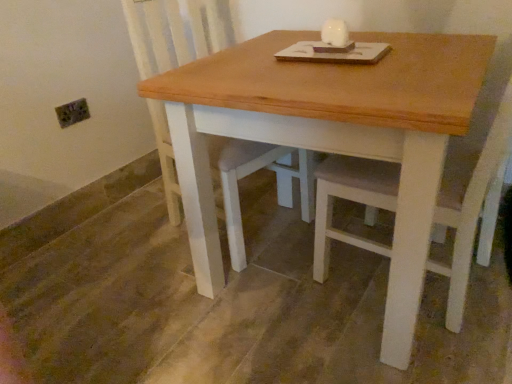
Question: From a real-world perspective, is wooden swivel chair at center located higher than wooden table at center?

Choices:
 (A) yes
 (B) no

Answer: (A)

Question: From the image's perspective, is wooden swivel chair at center beneath wooden table at center?

Choices:
 (A) yes
 (B) no

Answer: (B)

Question: Is wooden swivel chair at center at the right side of wooden table at center?

Choices:
 (A) yes
 (B) no

Answer: (B)

Question: Is the position of wooden swivel chair at center less distant than that of wooden table at center?

Choices:
 (A) yes
 (B) no

Answer: (B)

Question: From the image's perspective, is wooden swivel chair at center on top of wooden table at center?

Choices:
 (A) no
 (B) yes

Answer: (B)

Question: Is wooden swivel chair at center facing away from wooden table at center?

Choices:
 (A) yes
 (B) no

Answer: (B)

Question: Is wooden table at center smaller than wooden swivel chair at center?

Choices:
 (A) yes
 (B) no

Answer: (B)

Question: Would you say wooden table at center is a long distance from wooden swivel chair at center?

Choices:
 (A) yes
 (B) no

Answer: (B)

Question: Does wooden table at center contain wooden swivel chair at center?

Choices:
 (A) yes
 (B) no

Answer: (A)

Question: Are wooden table at center and wooden swivel chair at center beside each other?

Choices:
 (A) no
 (B) yes

Answer: (A)

Question: Is wooden table at center bigger than wooden swivel chair at center?

Choices:
 (A) yes
 (B) no

Answer: (A)

Question: From the image's perspective, is wooden table at center below wooden swivel chair at center?

Choices:
 (A) no
 (B) yes

Answer: (B)

Question: Is wooden table at center spatially inside wooden swivel chair at center, or outside of it?

Choices:
 (A) inside
 (B) outside

Answer: (B)